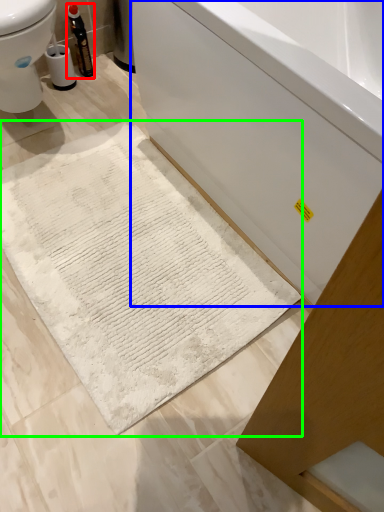
Question: Considering the real-world distances, which object is farthest from bottle (highlighted by a red box)? bathtub (highlighted by a blue box) or bath mat (highlighted by a green box)?

Choices:
 (A) bathtub
 (B) bath mat

Answer: (A)